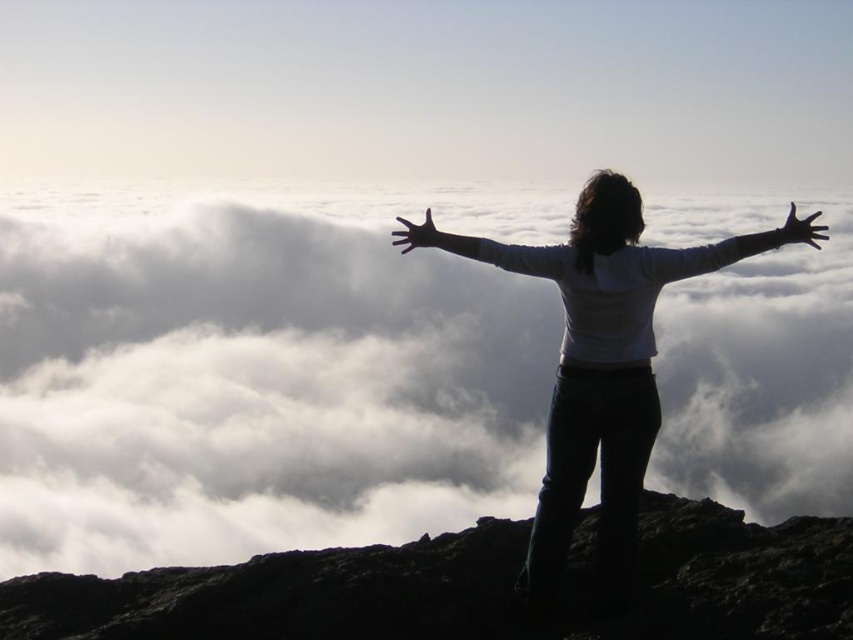
Question: Can you confirm if rugged stone mountain at center is positioned to the right of smooth skin arm at center?

Choices:
 (A) no
 (B) yes

Answer: (A)

Question: Based on their relative distances, which object is nearer to the smooth skin arm at center?

Choices:
 (A) silvery metallic arm at upper right
 (B) rugged stone mountain at center
 (C) silhouette jeans at center

Answer: (C)

Question: Which of the following is the closest to the observer?

Choices:
 (A) (412, 227)
 (B) (198, 388)

Answer: (A)

Question: Is rugged stone mountain at center positioned before smooth skin arm at center?

Choices:
 (A) yes
 (B) no

Answer: (B)

Question: Is white fluffy cloud at upper center smaller than transparent glass hand at center?

Choices:
 (A) no
 (B) yes

Answer: (A)

Question: Which point is farther from the camera taking this photo?

Choices:
 (A) (190, 579)
 (B) (396, 236)
 (C) (689, 381)
 (D) (431, 230)

Answer: (C)